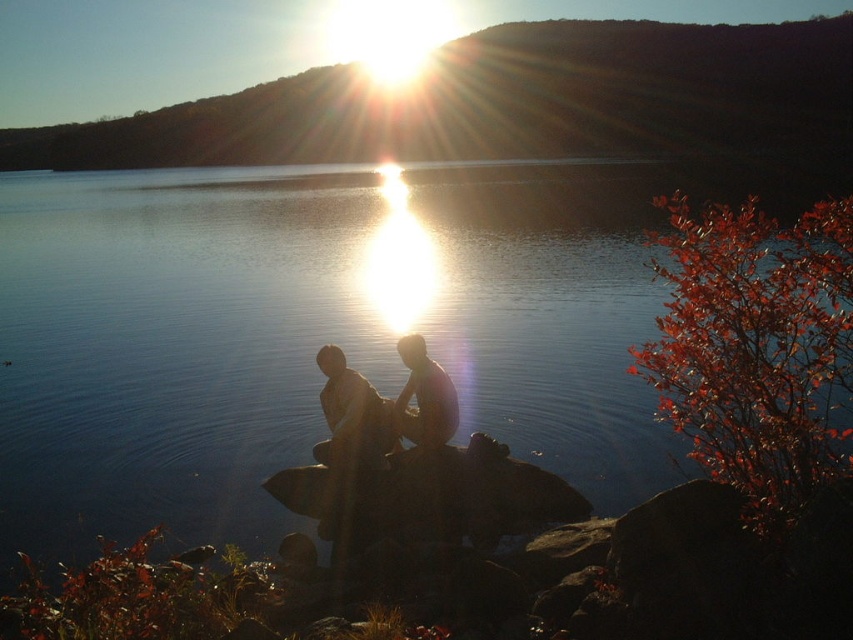
Looking at this image, you are a photographer standing at the edge of the lake. You want to take a photo of the matte brown couple at center and the transparent water at center. How far apart are these two subjects in the scene?

The transparent water at center is 17.11 meters away from the matte brown couple at center, so the distance between them is 17.11 meters.

You are a photographer trying to capture the sunset at the lakeside. You notice the matte brown couple at center and the smooth skin man at center in your frame. Which of the two subjects is positioned lower in the image?

The matte brown couple at center is positioned lower than the smooth skin man at center in the image.

You are a photographer trying to capture the sunset at the lakeside. You notice the matte brown couple at center and the smooth skin man at center. Which of them is positioned to the left side when facing the lake?

The matte brown couple at center is positioned to the left of the smooth skin man at center.